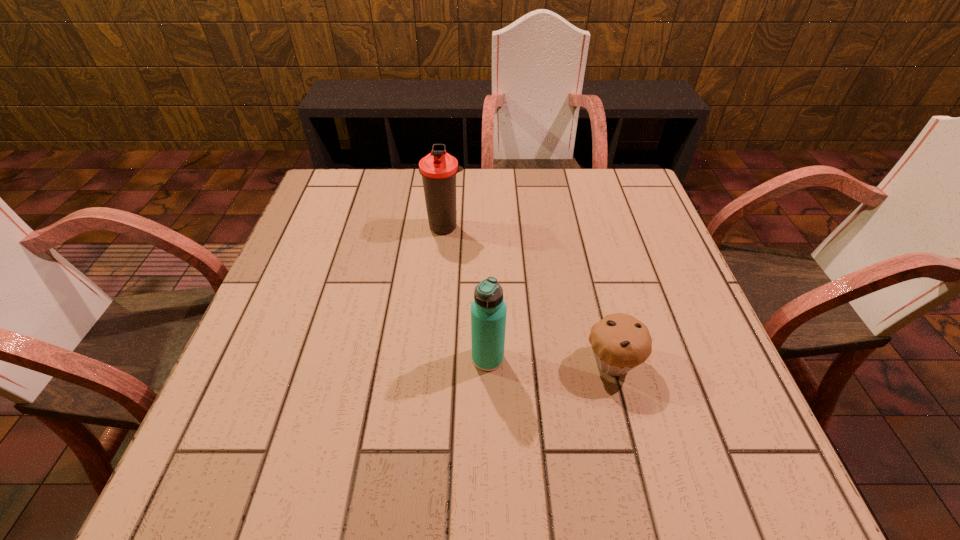
At what (x,y) coordinates should I click in order to perform the action: click on the farthest object. Please return your answer as a coordinate pair (x, y). Image resolution: width=960 pixels, height=540 pixels. Looking at the image, I should click on (438, 169).

Where is `the leftmost object`? This screenshot has width=960, height=540. the leftmost object is located at coordinates (438, 169).

Locate an element on the screen. The width and height of the screenshot is (960, 540). the second object from right to left is located at coordinates (488, 310).

The height and width of the screenshot is (540, 960). I want to click on the right thermos bottle, so click(488, 310).

You are a GUI agent. You are given a task and a screenshot of the screen. Output one action in this format:
    pyautogui.click(x=<x>, y=<y>)
    Task: Click on the rightmost object
    
    Given the screenshot: What is the action you would take?
    pyautogui.click(x=620, y=342)

Locate an element on the screen. the shortest object is located at coordinates (620, 342).

This screenshot has width=960, height=540. I want to click on free region located on the front of the leftmost object, so click(x=443, y=254).

You are a GUI agent. You are given a task and a screenshot of the screen. Output one action in this format:
    pyautogui.click(x=<x>, y=<y>)
    Task: Click on the free space located 0.110m on the right of the right thermos bottle
    This screenshot has width=960, height=540.
    Given the screenshot: What is the action you would take?
    pyautogui.click(x=561, y=358)

This screenshot has width=960, height=540. I want to click on free region located 0.160m on the right of the muffin, so click(724, 362).

Find the location of a particular element. The height and width of the screenshot is (540, 960). object situated at the far edge is located at coordinates coord(438,169).